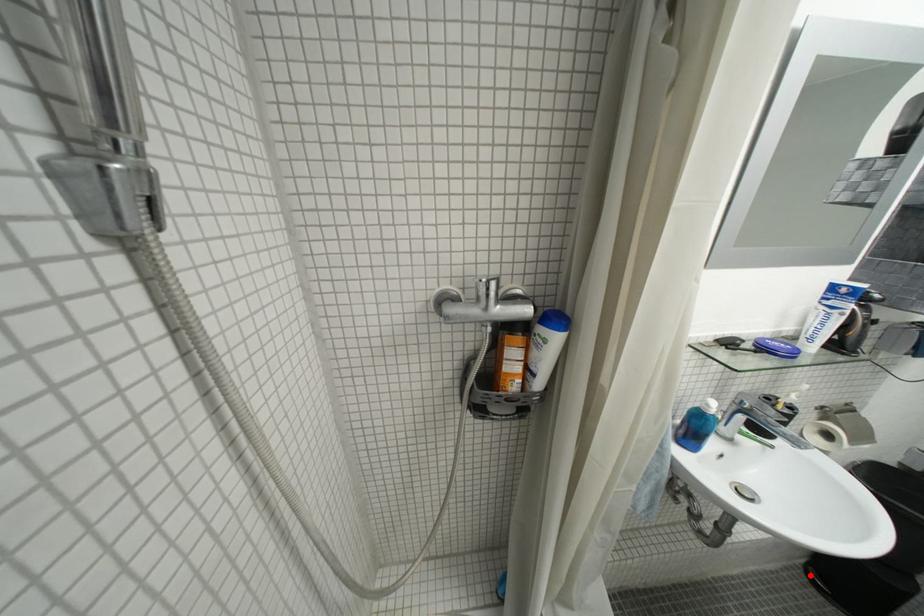
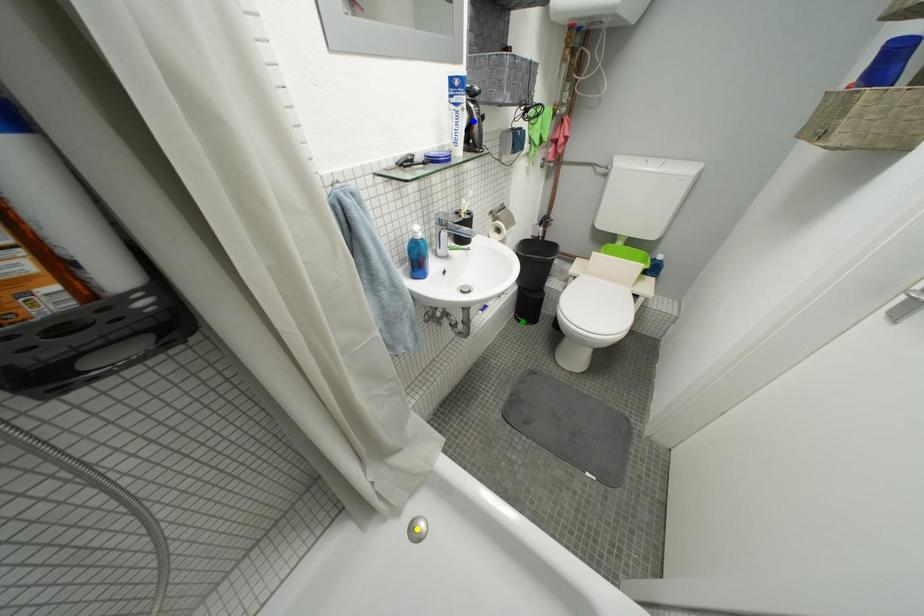
Question: I am providing you with two images of the same scene from different viewpoints. A red point is marked on the first image. You are given multiple points on the second image. Which mark in image 2 goes with the point in image 1?

Choices:
 (A) green point
 (B) yellow point
 (C) blue point

Answer: (A)